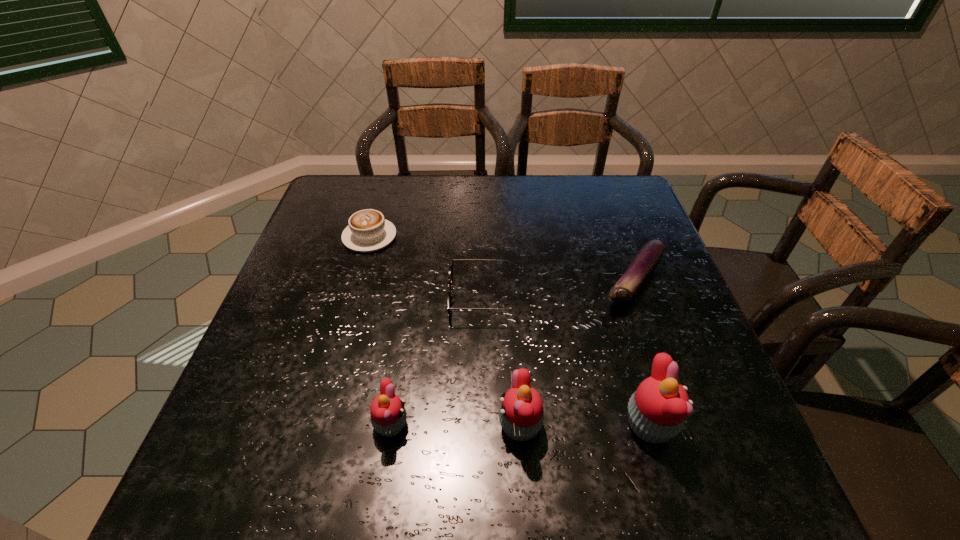
Where is `free space between the second shortest cupcake and the rightmost cupcake`? free space between the second shortest cupcake and the rightmost cupcake is located at coordinates [x=585, y=426].

Where is `vacant area between the leftmost object and the eggplant`? vacant area between the leftmost object and the eggplant is located at coordinates (501, 259).

At what (x,y) coordinates should I click in order to perform the action: click on free spot between the leftmost object and the spectacles. Please return your answer as a coordinate pair (x, y). Looking at the image, I should click on (428, 267).

At what (x,y) coordinates should I click in order to perform the action: click on object that can be found as the fourth closest to the leftmost object. Please return your answer as a coordinate pair (x, y). This screenshot has width=960, height=540. Looking at the image, I should click on (648, 257).

The width and height of the screenshot is (960, 540). Find the location of `object that can be found as the fourth closest to the shortest cupcake`. object that can be found as the fourth closest to the shortest cupcake is located at coordinates click(x=367, y=231).

At what (x,y) coordinates should I click in order to perform the action: click on cupcake that is the closest to the shortest cupcake. Please return your answer as a coordinate pair (x, y). Looking at the image, I should click on (521, 415).

Identify which cupcake is the second closest to the fifth shortest object. Please provide its 2D coordinates. Your answer should be formatted as a tuple, i.e. [(x, y)], where the tuple contains the x and y coordinates of a point satisfying the conditions above.

[(388, 415)]

Find the location of a particular element. free space that satisfies the following two spatial constraints: 1. on the front side of the eggplant; 2. on the face of the fifth object from right to left is located at coordinates (684, 426).